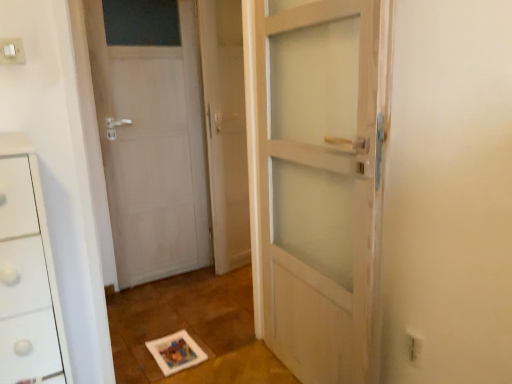
Question: In the image, is white plastic electric outlet at lower right, the 2th electric outlet when ordered from top to bottom, positioned in front of or behind white matte door at left?

Choices:
 (A) front
 (B) behind

Answer: (A)

Question: From the image's perspective, is white plastic electric outlet at lower right, arranged as the second electric outlet when viewed from the left, above or below white matte door at left?

Choices:
 (A) above
 (B) below

Answer: (B)

Question: Considering the real-world distances, which object is farthest from the white plastic electric outlet at lower right, the 2th electric outlet when ordered from top to bottom?

Choices:
 (A) clear glass screen door at center
 (B) white plastic electric outlet at upper left, acting as the first electric outlet starting from the top
 (C) white matte door at left

Answer: (C)

Question: Estimate the real-world distances between objects in this image. Which object is closer to the clear glass screen door at center?

Choices:
 (A) white plastic electric outlet at upper left, the second electric outlet viewed from the right
 (B) white matte door at left
 (C) white plastic electric outlet at lower right, which is the first electric outlet from right to left

Answer: (B)